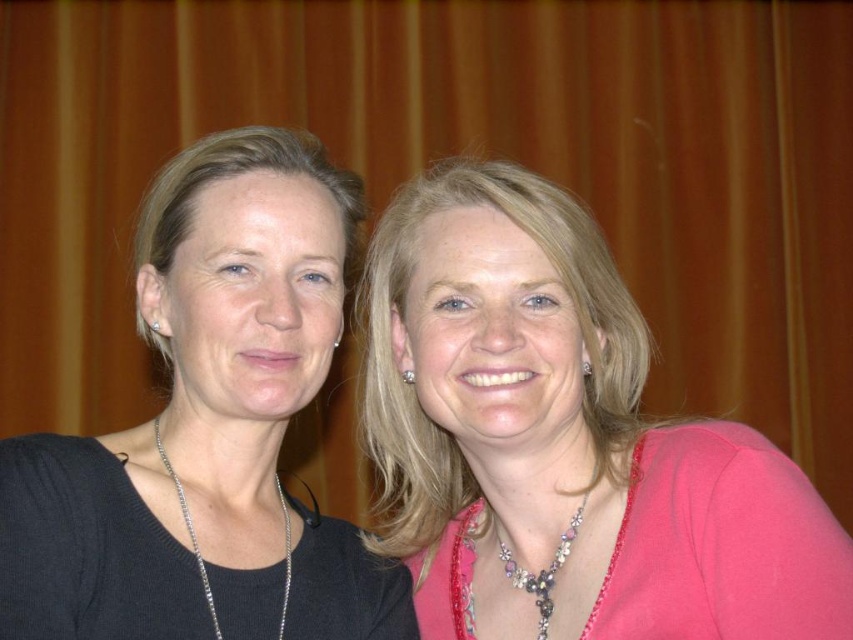
You are a photographer adjusting the focus on your camera. You need to ensure that both the pink satin blouse at center and the silver metallic necklace at center are in sharp focus. Given that your camera has a depth of field that can cover 12 inches, will both items be in focus?

The distance between the pink satin blouse at center and the silver metallic necklace at center is 11.67 inches, which is within the camera depth of field of 12 inches. Therefore, both items will be in focus.

You are organizing a clothing display and need to place the pink satin blouse at center and the black matte sweater at left. If the display area has a width of 1.2 meters, will both items fit side by side without overlapping?

The pink satin blouse at center is bigger than the black matte sweater at left. Since the pink blouse is larger, it might occupy more space, but without specific measurements, it is uncertain if they will fit within 1.2 meters. More information is needed.

You are organizing a photoshoot and need to ensure that the black matte sweater at left and the pearl and crystal necklace at center are positioned correctly according to the scene. Based on their placement, which object is closer to the left edge of the image?

The black matte sweater at left is closer to the left edge of the image because it is positioned to the left of the pearl and crystal necklace at center.